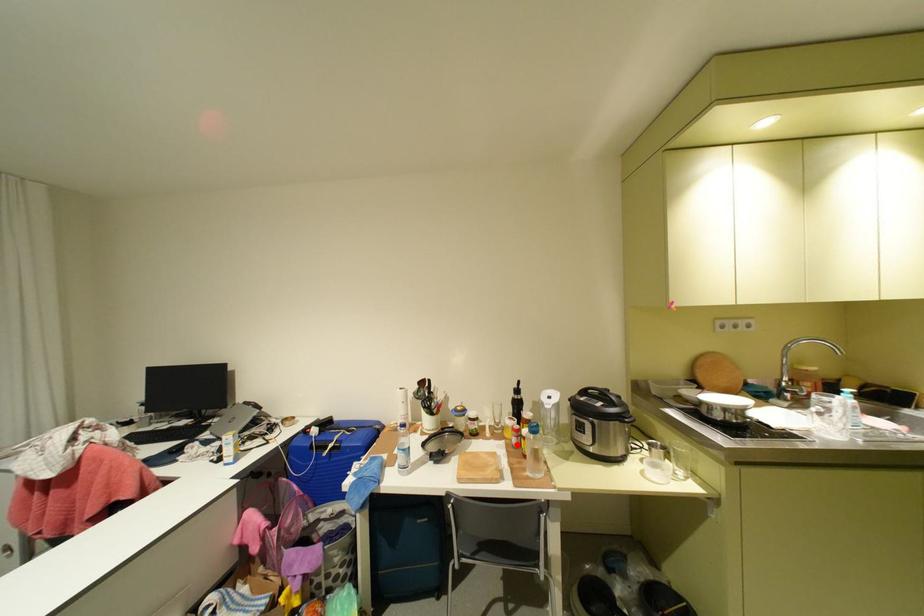
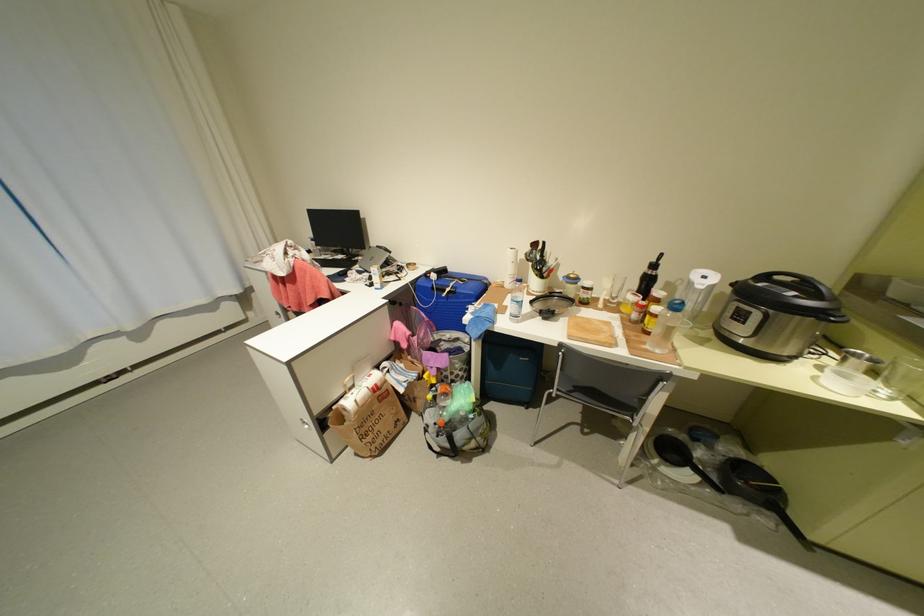
Locate, in the second image, the point that corresponds to the highlighted location in the first image.

(633, 318)